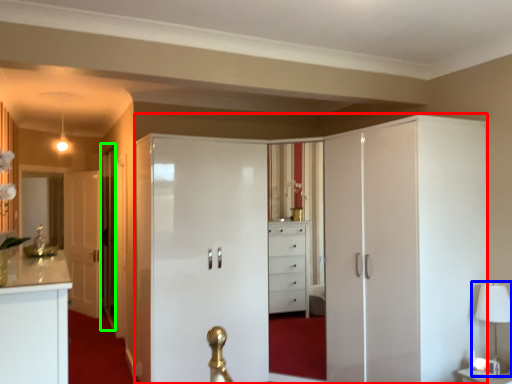
Question: Based on their relative distances, which object is nearer to dresser (highlighted by a red box)? Choose from table lamp (highlighted by a blue box) and glass door (highlighted by a green box).

Choices:
 (A) table lamp
 (B) glass door

Answer: (A)